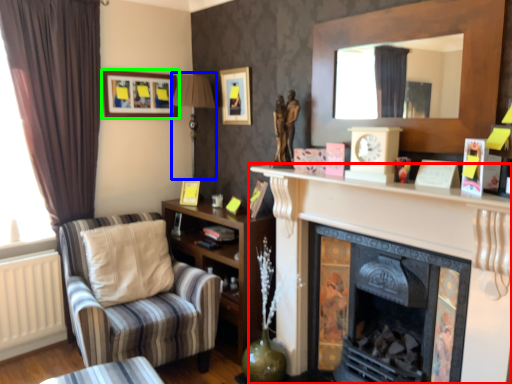
Question: Which object is positioned farthest from fireplace (highlighted by a red box)? Select from lamp (highlighted by a blue box) and picture frame (highlighted by a green box).

Choices:
 (A) lamp
 (B) picture frame

Answer: (B)